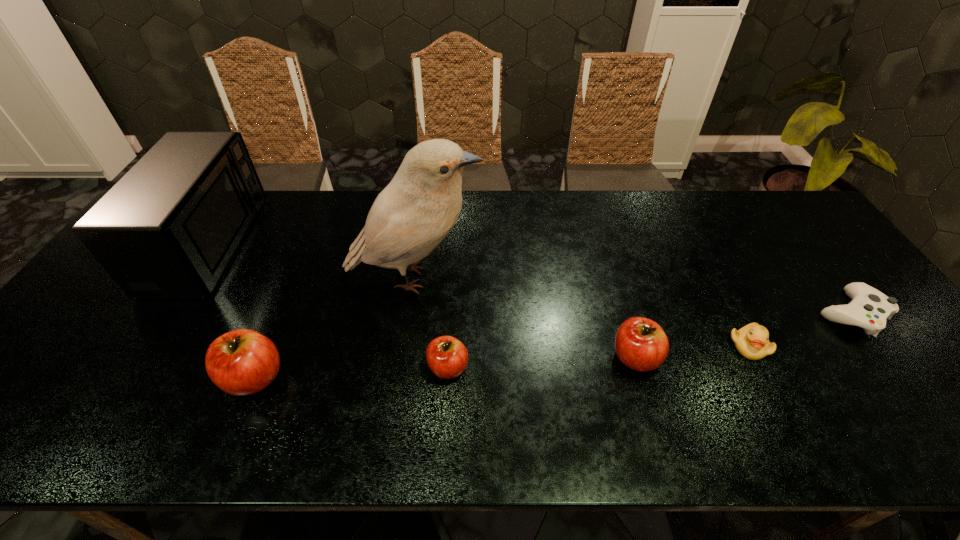
Locate an element on the screen. the second object from left to right is located at coordinates (241, 362).

Find the location of `the tallest apple`. the tallest apple is located at coordinates (241, 362).

Image resolution: width=960 pixels, height=540 pixels. Find the location of `the fifth tallest object`. the fifth tallest object is located at coordinates (447, 357).

I want to click on the shortest apple, so coord(447,357).

You are a GUI agent. You are given a task and a screenshot of the screen. Output one action in this format:
    pyautogui.click(x=<x>, y=<y>)
    Task: Click on the second shortest apple
    The height and width of the screenshot is (540, 960).
    Given the screenshot: What is the action you would take?
    tap(641, 344)

Where is `the rightmost apple`? This screenshot has width=960, height=540. the rightmost apple is located at coordinates (641, 344).

The height and width of the screenshot is (540, 960). Find the location of `the sixth shortest object`. the sixth shortest object is located at coordinates (170, 226).

Identify the location of the leftmost object. Image resolution: width=960 pixels, height=540 pixels. (170, 226).

I want to click on the shortest object, so click(x=869, y=309).

The height and width of the screenshot is (540, 960). In order to click on the rightmost object in this screenshot , I will do `click(869, 309)`.